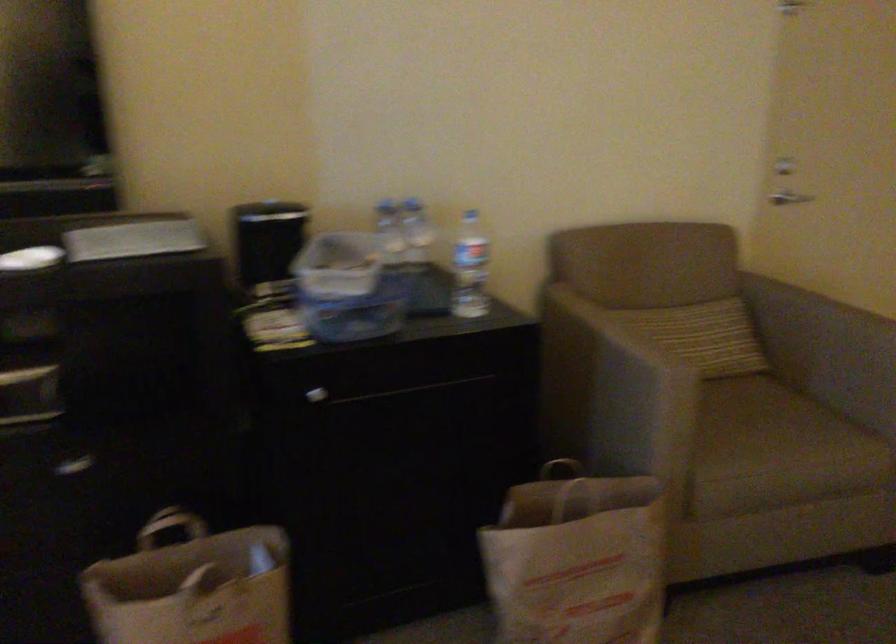
The width and height of the screenshot is (896, 644). What do you see at coordinates (762, 418) in the screenshot? I see `a chair sitting surface` at bounding box center [762, 418].